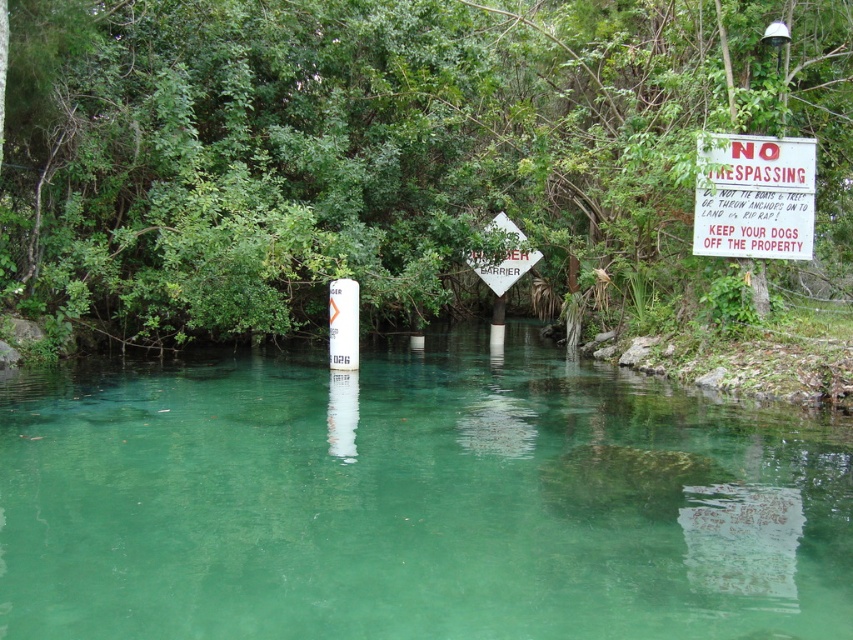
Question: Does green translucent water at center have a larger size compared to red plastic sign at upper right?

Choices:
 (A) yes
 (B) no

Answer: (A)

Question: Based on their relative distances, which object is farther from the green translucent water at center?

Choices:
 (A) white diamond-shaped sign at center
 (B) red plastic sign at upper right

Answer: (A)

Question: Which object is the farthest from the green translucent water at center?

Choices:
 (A) white diamond-shaped sign at center
 (B) red plastic sign at upper right

Answer: (A)

Question: Is green translucent water at center above red plastic sign at upper right?

Choices:
 (A) no
 (B) yes

Answer: (A)

Question: Among these points, which one is nearest to the camera?

Choices:
 (A) (705, 225)
 (B) (541, 371)
 (C) (517, 269)

Answer: (A)

Question: In this image, where is red plastic sign at upper right located relative to white diamond-shaped sign at center?

Choices:
 (A) left
 (B) right

Answer: (B)